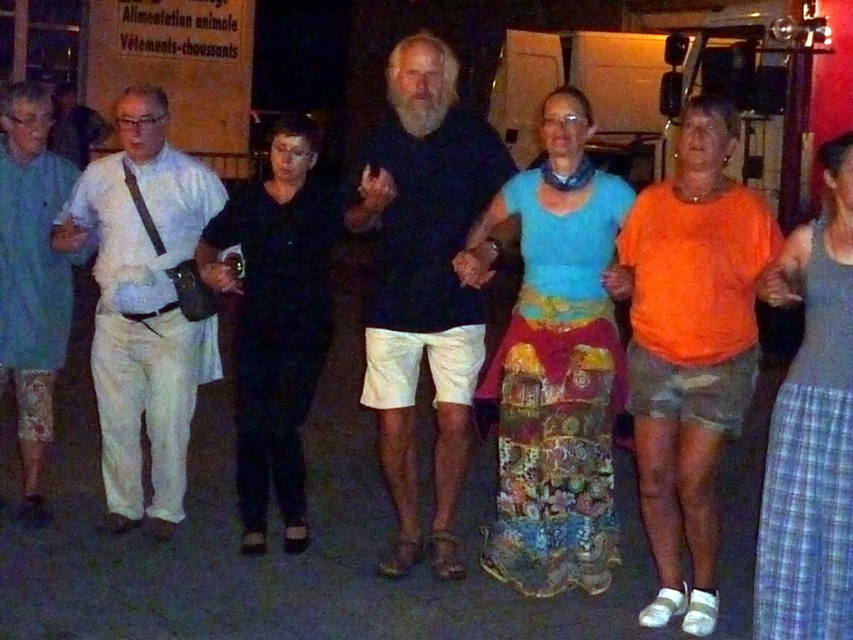
You are a photographer trying to capture a photo of the dark blue cotton shirt at center without the orange cotton shirt at right blocking it. What should you do?

Move to the side so that the orange cotton shirt at right is no longer in front of the dark blue cotton shirt at center. Since the orange cotton shirt at right is currently in front, adjusting your position can allow you to frame the shot without obstruction.

In the scene shown: You are a photographer trying to capture a photo of the orange cotton shirt at right and the gray plaid skirt at lower right. Based on their positions, which one should you focus on first if you want to frame them both in the same shot?

The orange cotton shirt at right is located below the gray plaid skirt at lower right, so you should focus on the gray plaid skirt at lower right first to ensure both are in frame.

You are a photographer trying to capture a group photo of the blue cotton shirt at center and the light blue cotton shirt at left. Since you want to ensure both shirts are clearly visible in the frame, which shirt should you focus on first to account for their sizes?

The blue cotton shirt at center is taller than the light blue cotton shirt at left, so you should focus on the blue cotton shirt at center first to ensure its details are captured clearly before adjusting for the smaller one.